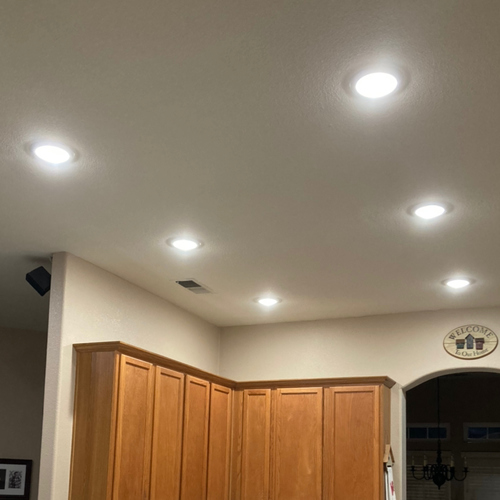
Identify the location of chandelier. (438, 469).